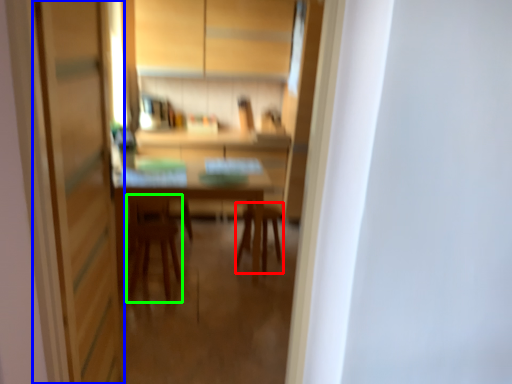
Question: Which object is the closest to the chair (highlighted by a red box)? Choose among these: screen door (highlighted by a blue box) or armchair (highlighted by a green box).

Choices:
 (A) screen door
 (B) armchair

Answer: (B)